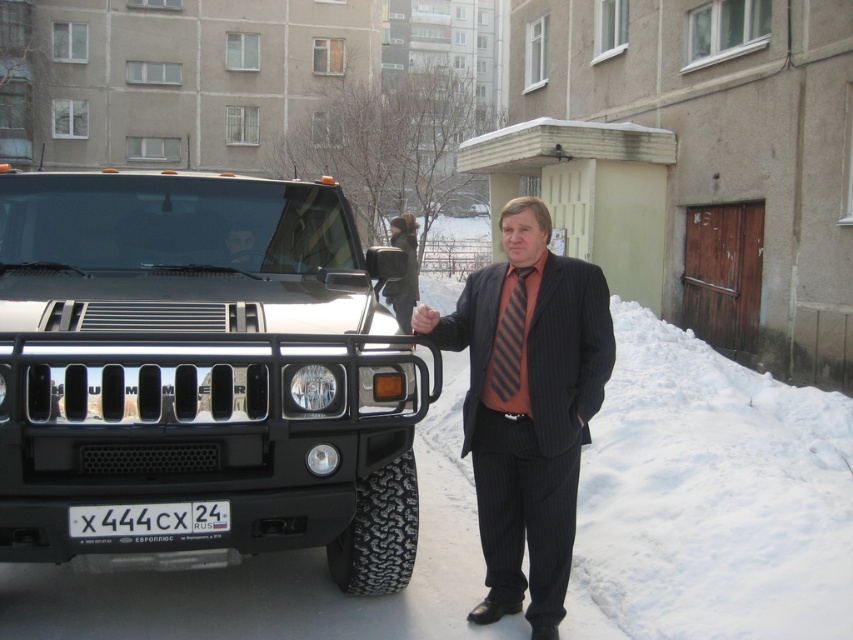
Question: Does white plastic license plate at center have a larger size compared to matte black hand at center?

Choices:
 (A) yes
 (B) no

Answer: (A)

Question: Which point is farther to the camera?

Choices:
 (A) matte black hand at center
 (B) white plastic license plate at center

Answer: (A)

Question: Does shiny chrome hummer at center have a larger size compared to matte black hand at center?

Choices:
 (A) yes
 (B) no

Answer: (A)

Question: Which point appears closest to the camera in this image?

Choices:
 (A) (186, 221)
 (B) (437, 320)

Answer: (B)

Question: Is shiny chrome hummer at center further to the viewer compared to striped fabric tie at center?

Choices:
 (A) yes
 (B) no

Answer: (B)

Question: Considering the real-world distances, which object is closest to the striped tie at center?

Choices:
 (A) striped fabric tie at center
 (B) matte black hand at center

Answer: (A)